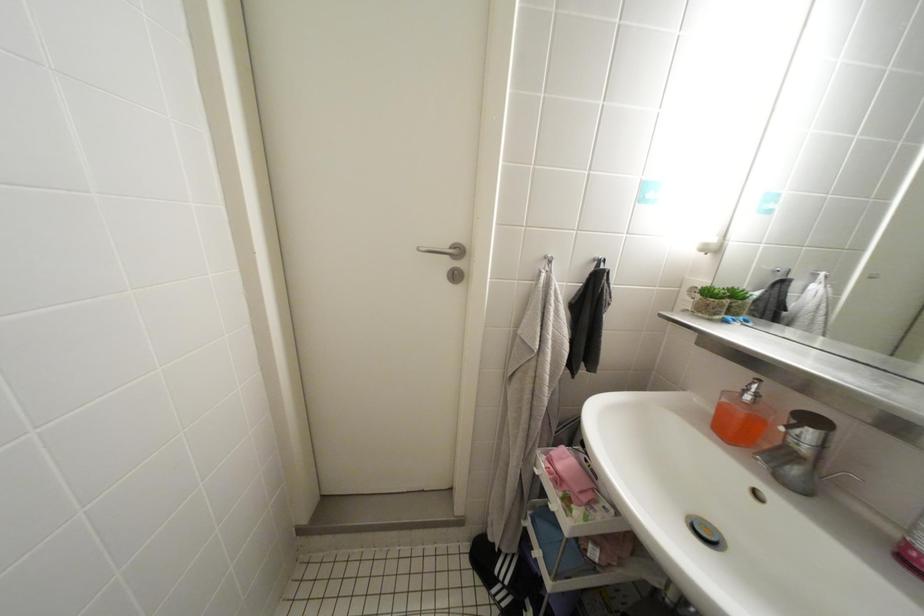
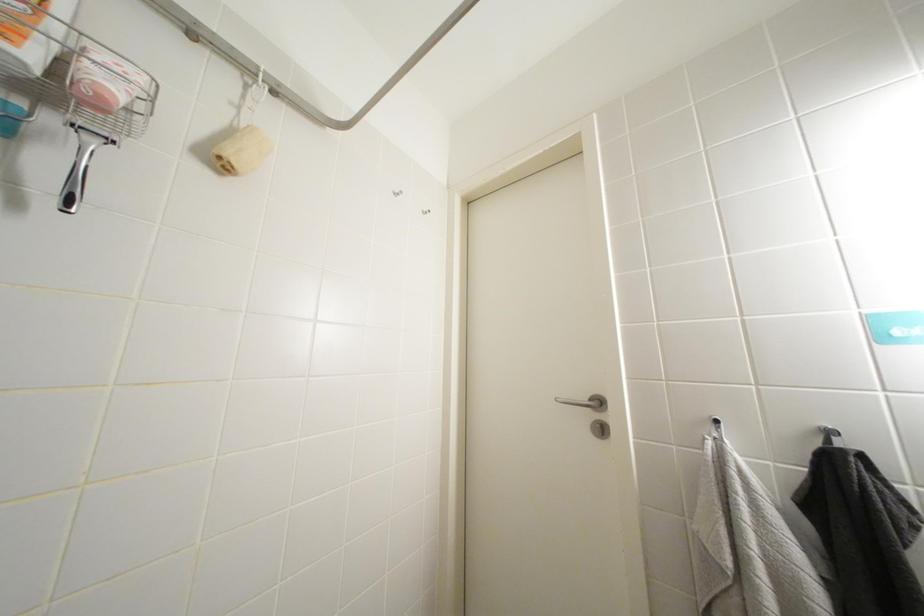
First-person continuous shooting, in which direction is the camera rotating?

The rotation direction of the camera is left-up.